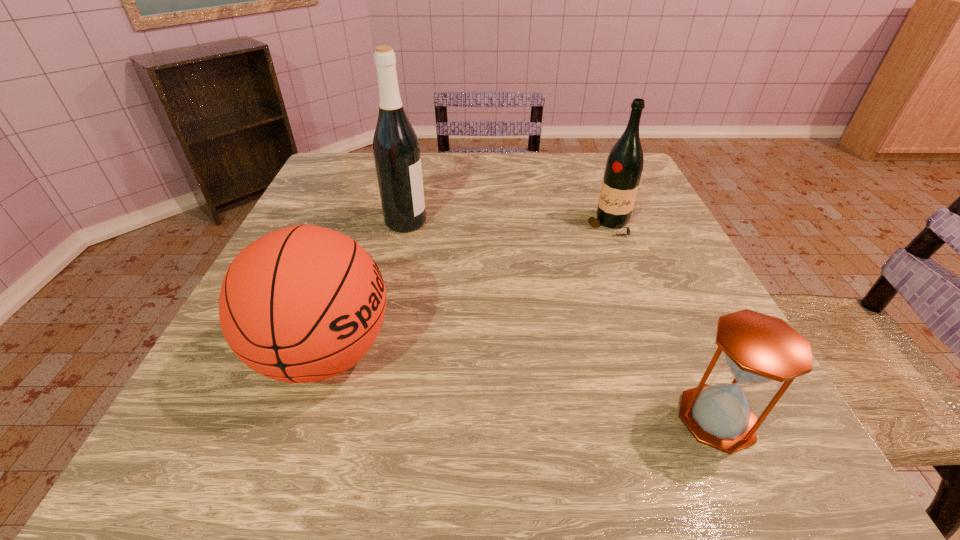
Identify the location of object at the near edge. tap(758, 348).

This screenshot has width=960, height=540. Find the location of `object at the left edge`. object at the left edge is located at coordinates coord(301,304).

At what (x,y) coordinates should I click in order to perform the action: click on wine bottle located at the right edge. Please return your answer as a coordinate pair (x, y). This screenshot has height=540, width=960. Looking at the image, I should click on (624, 165).

At what (x,y) coordinates should I click in order to perform the action: click on hourglass at the right edge. Please return your answer as a coordinate pair (x, y). The image size is (960, 540). Looking at the image, I should click on (758, 348).

This screenshot has width=960, height=540. I want to click on object that is at the near right corner, so click(758, 348).

In the image, there is a desktop. Where is `free region at the far edge`? The height and width of the screenshot is (540, 960). free region at the far edge is located at coordinates (379, 194).

This screenshot has width=960, height=540. Find the location of `vacant region at the near edge of the desktop`. vacant region at the near edge of the desktop is located at coordinates (405, 441).

Where is `blank space at the left edge of the desktop`? The image size is (960, 540). blank space at the left edge of the desktop is located at coordinates (240, 399).

At what (x,y) coordinates should I click in order to perform the action: click on vacant region at the right edge of the desktop. Please return your answer as a coordinate pair (x, y). Looking at the image, I should click on (673, 307).

Locate an element on the screen. The image size is (960, 540). vacant space at the far left corner of the desktop is located at coordinates 352,179.